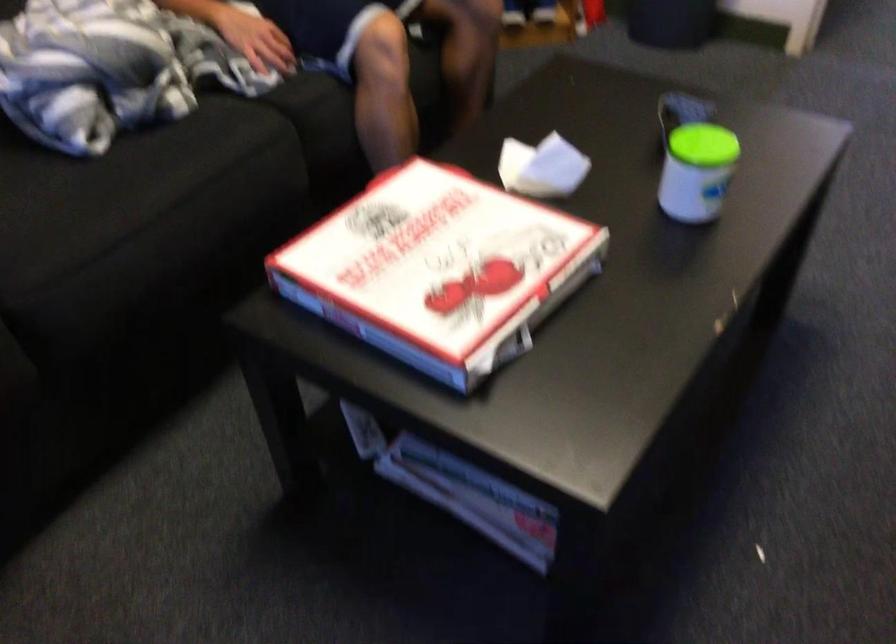
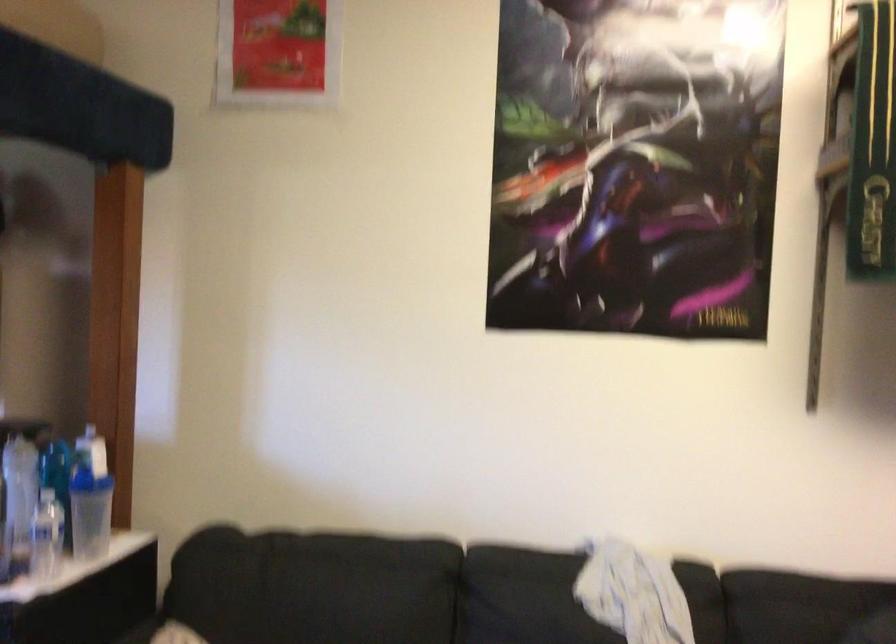
Question: The camera is either moving clockwise (left) or counter-clockwise (right) around the object. The first image is from the beginning of the video and the second image is from the end. Is the camera moving left or right when shooting the video?

Choices:
 (A) Left
 (B) Right

Answer: (B)